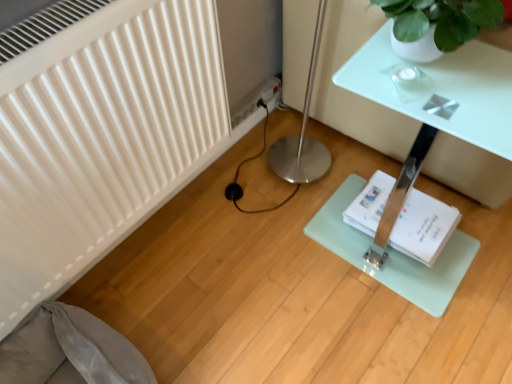
Question: Can you confirm if gray fabric swivel chair at lower left is thinner than clear glass table at center?

Choices:
 (A) yes
 (B) no

Answer: (A)

Question: Is gray fabric swivel chair at lower left wider than clear glass table at center?

Choices:
 (A) yes
 (B) no

Answer: (B)

Question: Can clear glass table at center be found inside gray fabric swivel chair at lower left?

Choices:
 (A) no
 (B) yes

Answer: (A)

Question: Can you confirm if gray fabric swivel chair at lower left is shorter than clear glass table at center?

Choices:
 (A) no
 (B) yes

Answer: (B)

Question: Considering the relative sizes of gray fabric swivel chair at lower left and clear glass table at center in the image provided, is gray fabric swivel chair at lower left smaller than clear glass table at center?

Choices:
 (A) yes
 (B) no

Answer: (A)

Question: Would you say gray fabric swivel chair at lower left is outside clear glass table at center?

Choices:
 (A) yes
 (B) no

Answer: (A)

Question: Is clear glass table at center to the left of white paper book at center from the viewer's perspective?

Choices:
 (A) yes
 (B) no

Answer: (B)

Question: Is clear glass table at center bigger than white paper book at center?

Choices:
 (A) yes
 (B) no

Answer: (A)

Question: Can you confirm if clear glass table at center is wider than white paper book at center?

Choices:
 (A) no
 (B) yes

Answer: (B)

Question: Does clear glass table at center turn towards white paper book at center?

Choices:
 (A) yes
 (B) no

Answer: (B)

Question: Is the depth of clear glass table at center less than that of white paper book at center?

Choices:
 (A) yes
 (B) no

Answer: (A)

Question: Is clear glass table at center thinner than white paper book at center?

Choices:
 (A) yes
 (B) no

Answer: (B)

Question: From a real-world perspective, does white paper book at center sit lower than gray fabric swivel chair at lower left?

Choices:
 (A) yes
 (B) no

Answer: (A)